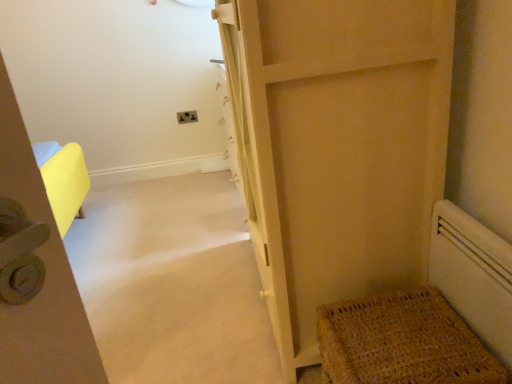
In order to face matte wood door at center, should I rotate leftwards or rightwards?

Turn right approximately 6.258 degrees to face it.

The image size is (512, 384). Find the location of `woven brown mat at lower right`. woven brown mat at lower right is located at coordinates (402, 342).

Locate an element on the screen. matte wood door at center is located at coordinates (337, 147).

Can you tell me how much white matte radiator at lower right and matte plastic electric outlet at center differ in facing direction?

Result: The angular difference between white matte radiator at lower right and matte plastic electric outlet at center is 90 degrees.

Is white matte radiator at lower right further to the viewer compared to matte plastic electric outlet at center?

No.

You are a GUI agent. You are given a task and a screenshot of the screen. Output one action in this format:
    pyautogui.click(x=<x>, y=<y>)
    Task: Click on the electric outlet lying behind the white matte radiator at lower right
    
    Given the screenshot: What is the action you would take?
    pyautogui.click(x=187, y=117)

Is point (470, 293) closer or farther from the camera than point (187, 113)?

Point (470, 293) is positioned closer to the camera compared to point (187, 113).

From the picture: From a real-world perspective, which is physically above, matte plastic electric outlet at center or white matte radiator at lower right?

From a 3D spatial view, matte plastic electric outlet at center is above.

Could you tell me if matte plastic electric outlet at center is turned towards white matte radiator at lower right?

Yes.

Locate an element on the screen. The width and height of the screenshot is (512, 384). radiator below the matte plastic electric outlet at center (from the image's perspective) is located at coordinates (473, 275).

Is matte plastic electric outlet at center positioned beyond the bounds of white matte radiator at lower right?

Indeed, matte plastic electric outlet at center is completely outside white matte radiator at lower right.

You are a GUI agent. You are given a task and a screenshot of the screen. Output one action in this format:
    pyautogui.click(x=<x>, y=<y>)
    Task: Click on the radiator below the matte wood door at center (from the image's perspective)
    The width and height of the screenshot is (512, 384).
    Given the screenshot: What is the action you would take?
    pyautogui.click(x=473, y=275)

How many degrees apart are the facing directions of white matte radiator at lower right and matte wood door at center?

The facing directions of white matte radiator at lower right and matte wood door at center are 1.19 degrees apart.

From a real-world perspective, between white matte radiator at lower right and matte wood door at center, who is vertically higher?

From a 3D spatial view, matte wood door at center is above.

Considering the positions of objects white matte radiator at lower right and matte wood door at center in the image provided, who is more to the right, white matte radiator at lower right or matte wood door at center?

Positioned to the right is white matte radiator at lower right.

Considering the positions of points (302, 247) and (371, 353), is point (302, 247) closer to camera compared to point (371, 353)?

No, (302, 247) is further to viewer.

Does matte wood door at center touch woven brown mat at lower right?

No, matte wood door at center is not with woven brown mat at lower right.

From a real-world perspective, is matte wood door at center positioned above or below woven brown mat at lower right?

matte wood door at center is situated higher than woven brown mat at lower right in the real world.

What's the angular difference between matte wood door at center and woven brown mat at lower right's facing directions?

The angle between the facing direction of matte wood door at center and the facing direction of woven brown mat at lower right is 1.19 degrees.

From a real-world perspective, is matte wood door at center physically located above or below white matte radiator at lower right?

matte wood door at center is situated higher than white matte radiator at lower right in the real world.

Is matte wood door at center positioned behind white matte radiator at lower right?

Yes, matte wood door at center is behind white matte radiator at lower right.

Can you tell me how much matte wood door at center and white matte radiator at lower right differ in facing direction?

The facing directions of matte wood door at center and white matte radiator at lower right are 1.19 degrees apart.

Can you confirm if matte wood door at center is thinner than white matte radiator at lower right?

Incorrect, the width of matte wood door at center is not less than that of white matte radiator at lower right.

Would you consider woven brown mat at lower right to be distant from matte plastic electric outlet at center?

woven brown mat at lower right is far away from matte plastic electric outlet at center.

Is point (482, 347) farther from camera compared to point (178, 112)?

No.

Is woven brown mat at lower right aimed at matte plastic electric outlet at center?

No, woven brown mat at lower right does not turn towards matte plastic electric outlet at center.

Locate an element on the screen. The width and height of the screenshot is (512, 384). doormat below the matte plastic electric outlet at center (from the image's perspective) is located at coordinates (402, 342).

Is woven brown mat at lower right not close to matte wood door at center?

No, woven brown mat at lower right is in close proximity to matte wood door at center.

From a real-world perspective, which object stands above the other?

matte wood door at center.

Considering the sizes of woven brown mat at lower right and matte wood door at center in the image, is woven brown mat at lower right bigger or smaller than matte wood door at center?

Considering their sizes, woven brown mat at lower right takes up less space than matte wood door at center.

Where is `radiator below the matte plastic electric outlet at center (from the image's perspective)`? The image size is (512, 384). radiator below the matte plastic electric outlet at center (from the image's perspective) is located at coordinates (473, 275).

This screenshot has height=384, width=512. Identify the location of radiator in front of the matte plastic electric outlet at center. (473, 275).

Estimate the real-world distances between objects in this image. Which object is further from woven brown mat at lower right, matte wood door at center or white matte radiator at lower right?

matte wood door at center is positioned further to the anchor woven brown mat at lower right.

Estimate the real-world distances between objects in this image. Which object is further from white matte radiator at lower right, woven brown mat at lower right or matte wood door at center?

matte wood door at center.

Which object lies further to the anchor point white matte radiator at lower right, matte wood door at center or woven brown mat at lower right?

→ matte wood door at center lies further to white matte radiator at lower right than the other object.

Based on their spatial positions, is matte wood door at center or matte plastic electric outlet at center closer to woven brown mat at lower right?

matte wood door at center is positioned closer to the anchor woven brown mat at lower right.

From the image, which object appears to be nearer to matte wood door at center, matte plastic electric outlet at center or woven brown mat at lower right?

woven brown mat at lower right is closer to matte wood door at center.

When comparing their distances from matte plastic electric outlet at center, does white matte radiator at lower right or matte wood door at center seem closer?

matte wood door at center is closer to matte plastic electric outlet at center.

Based on their spatial positions, is woven brown mat at lower right or matte wood door at center further from matte plastic electric outlet at center?

woven brown mat at lower right is positioned further to the anchor matte plastic electric outlet at center.

Which object lies nearer to the anchor point matte wood door at center, woven brown mat at lower right or white matte radiator at lower right?

white matte radiator at lower right is positioned closer to the anchor matte wood door at center.

Locate an element on the screen. door between white matte radiator at lower right and matte plastic electric outlet at center in the front-back direction is located at coordinates (337, 147).

At what (x,y) coordinates should I click in order to perform the action: click on doormat between matte wood door at center and matte plastic electric outlet at center from front to back. Please return your answer as a coordinate pair (x, y). Looking at the image, I should click on (402, 342).

You are a GUI agent. You are given a task and a screenshot of the screen. Output one action in this format:
    pyautogui.click(x=<x>, y=<y>)
    Task: Click on the radiator between matte wood door at center and woven brown mat at lower right from top to bottom
    The width and height of the screenshot is (512, 384).
    Given the screenshot: What is the action you would take?
    pyautogui.click(x=473, y=275)

You are a GUI agent. You are given a task and a screenshot of the screen. Output one action in this format:
    pyautogui.click(x=<x>, y=<y>)
    Task: Click on the doormat located between white matte radiator at lower right and matte plastic electric outlet at center in the depth direction
    The height and width of the screenshot is (384, 512).
    Given the screenshot: What is the action you would take?
    pyautogui.click(x=402, y=342)